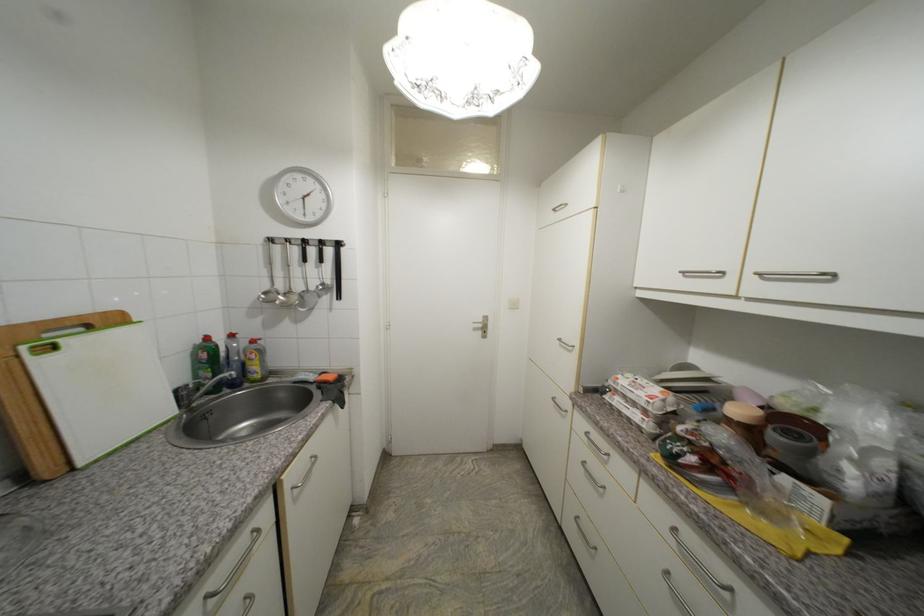
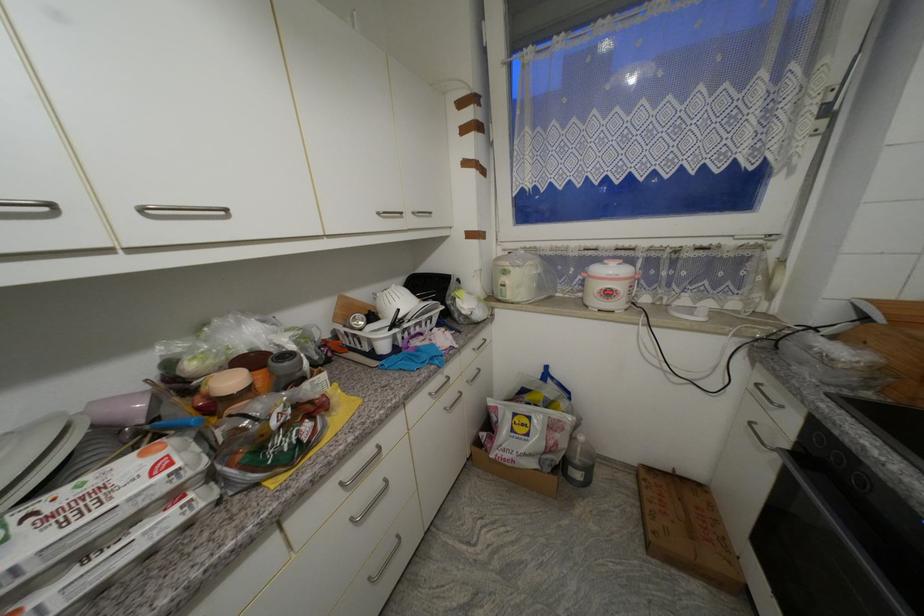
Find the pixel in the second image that matches point 667,392 in the first image.

(149, 456)